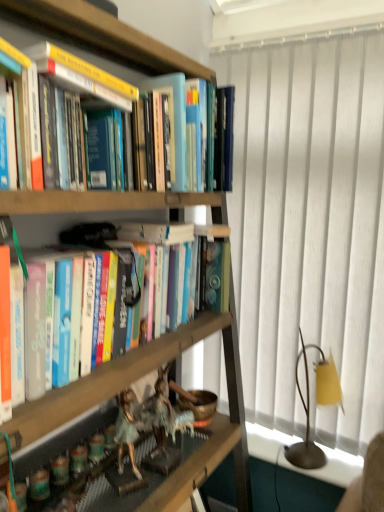
Question: Is hardcover books at center inside or outside of wooden bookcase at left?

Choices:
 (A) inside
 (B) outside

Answer: (A)

Question: From a real-world perspective, is hardcover books at center above or below wooden bookcase at left?

Choices:
 (A) above
 (B) below

Answer: (A)

Question: Which object is positioned closest to the white textured curtain at right?

Choices:
 (A) blue hardcover book at upper center, the first paperback book when ordered from back to front
 (B) yellow fabric lampshade at right
 (C) hardcover books at center
 (D) metallic figurines at lower left
 (E) wooden bookcase at left

Answer: (B)

Question: Estimate the real-world distances between objects in this image. Which object is farther from the hardcover book at upper left, which is the 2th paperback book from back to front?

Choices:
 (A) hardcover books at center
 (B) metallic figurines at lower left
 (C) white textured curtain at right
 (D) wooden bookcase at left
 (E) yellow fabric lampshade at right

Answer: (E)